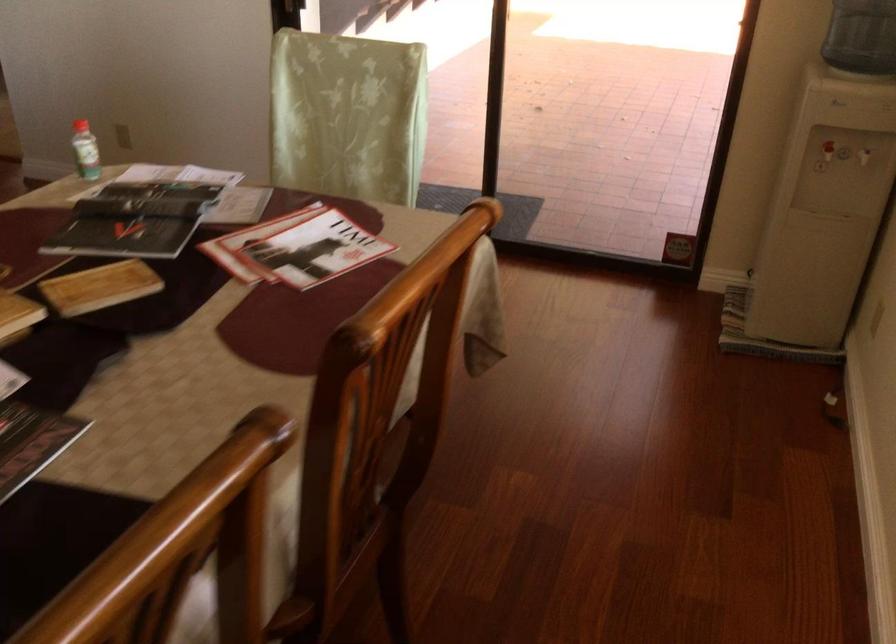
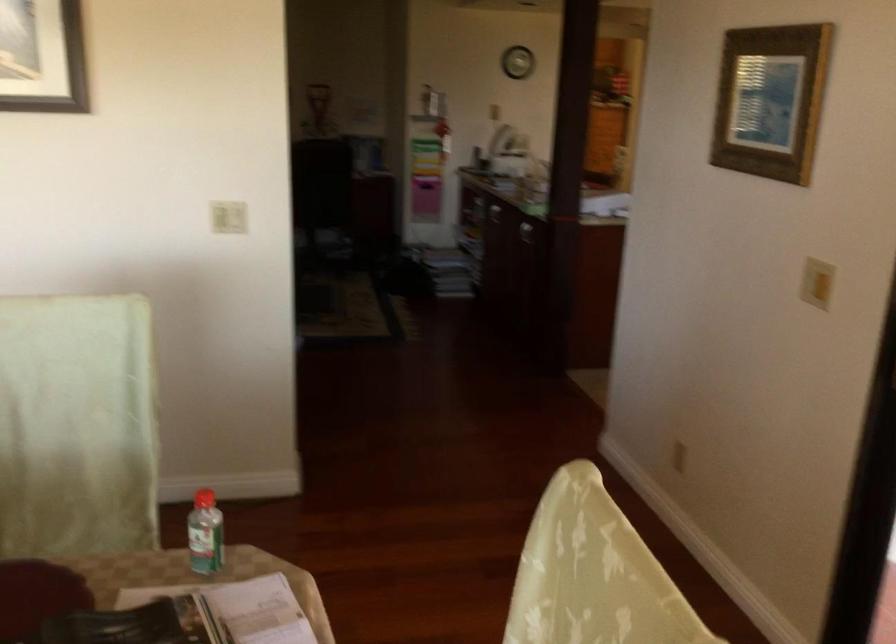
Where in the second image is the point corresponding to the point at 88,143 from the first image?

(204, 534)